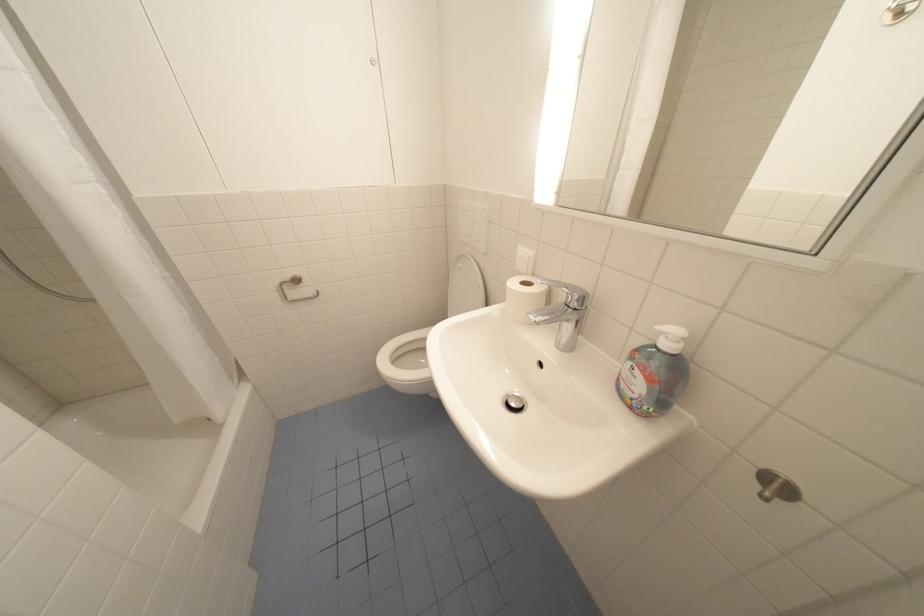
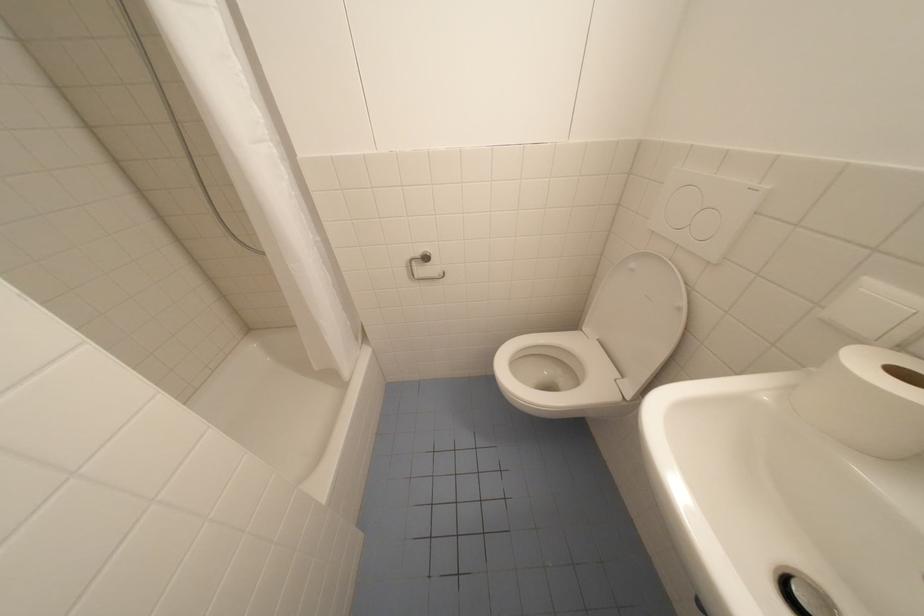
Question: How did the camera likely rotate?

Choices:
 (A) Left
 (B) Right
 (C) Up
 (D) Down

Answer: (A)